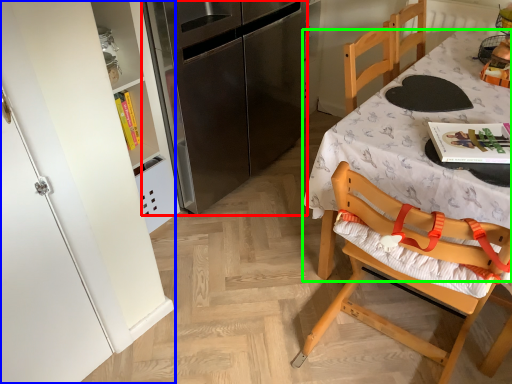
Question: Considering the real-world distances, which object is farthest from refrigerator (highlighted by a red box)? cabinetry (highlighted by a blue box) or desk (highlighted by a green box)?

Choices:
 (A) cabinetry
 (B) desk

Answer: (A)